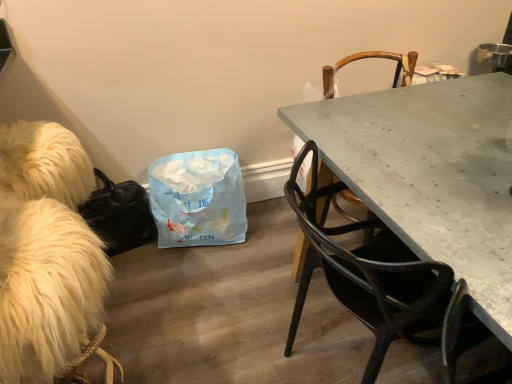
The height and width of the screenshot is (384, 512). What are the coordinates of `free spot in front of light blue paper bag at center` in the screenshot? It's located at coord(205,292).